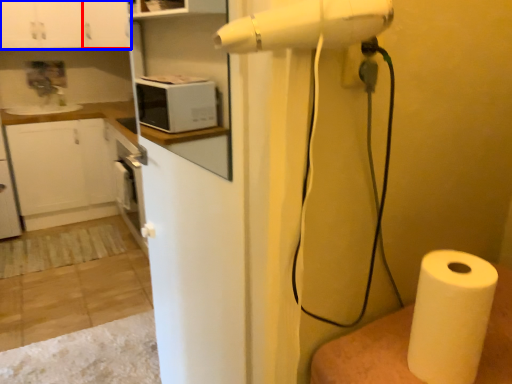
Question: Which object is further to the camera taking this photo, cabinetry (highlighted by a red box) or cabinetry (highlighted by a blue box)?

Choices:
 (A) cabinetry
 (B) cabinetry

Answer: (A)